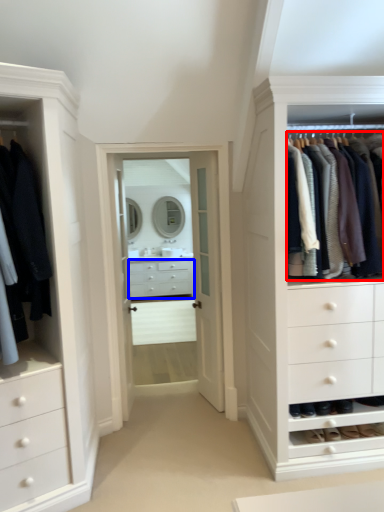
Question: Which object appears farthest to the camera in this image, clothing (highlighted by a red box) or drawer (highlighted by a blue box)?

Choices:
 (A) clothing
 (B) drawer

Answer: (B)